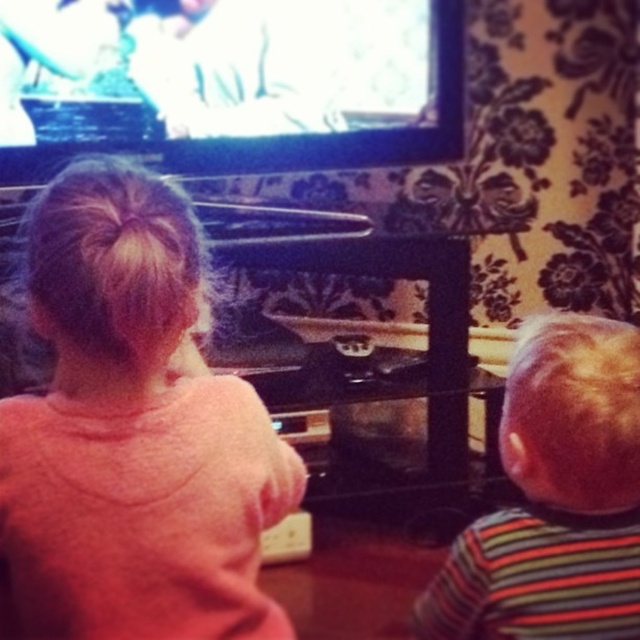
Is pink fleece sweatshirt at upper left below striped fabric shirt at right?

No, pink fleece sweatshirt at upper left is not below striped fabric shirt at right.

Between point (164, 577) and point (460, 608), which one is positioned behind?

The point (460, 608) is more distant.

Is point (131, 556) in front of point (604, 340)?

Yes, it is in front of point (604, 340).

Identify the location of pink fleece sweatshirt at upper left. The width and height of the screenshot is (640, 640). (132, 433).